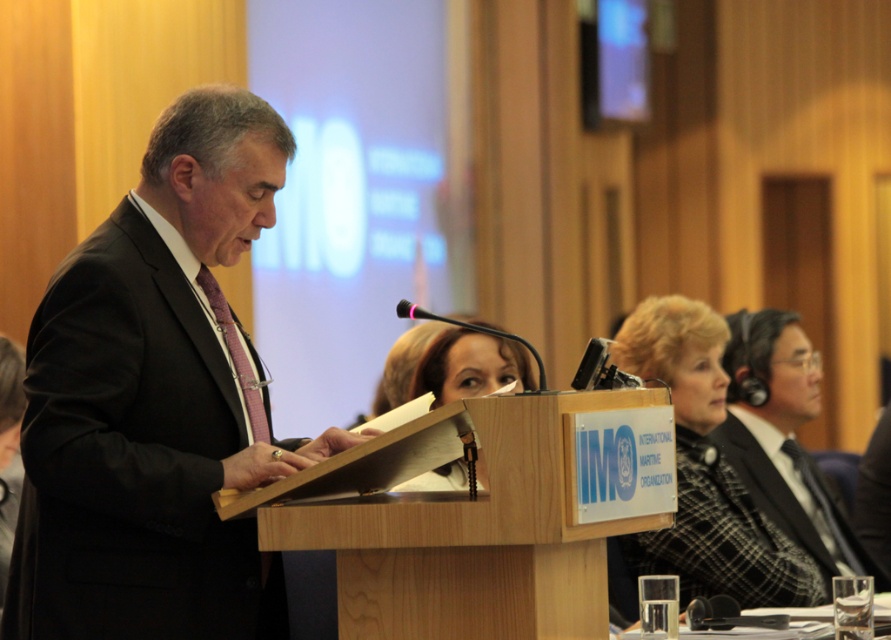
You are attending a virtual conference and need to focus on the speaker wearing the black suit at left. However, there are distractions from the matte black headphones at center. Which object should you look at to focus on the speaker?

The black suit at left is to the left of the matte black headphones at center, so to focus on the speaker, you should look at the black suit at left instead of the matte black headphones at center.

From the picture: You are attending a formal event and need to choose an outfit. You see a plaid wool blazer at center and a black wool suit at right. Which one is covering the other?

The plaid wool blazer at center is positioned over the black wool suit at right, so the plaid wool blazer at center is covering the black wool suit at right.